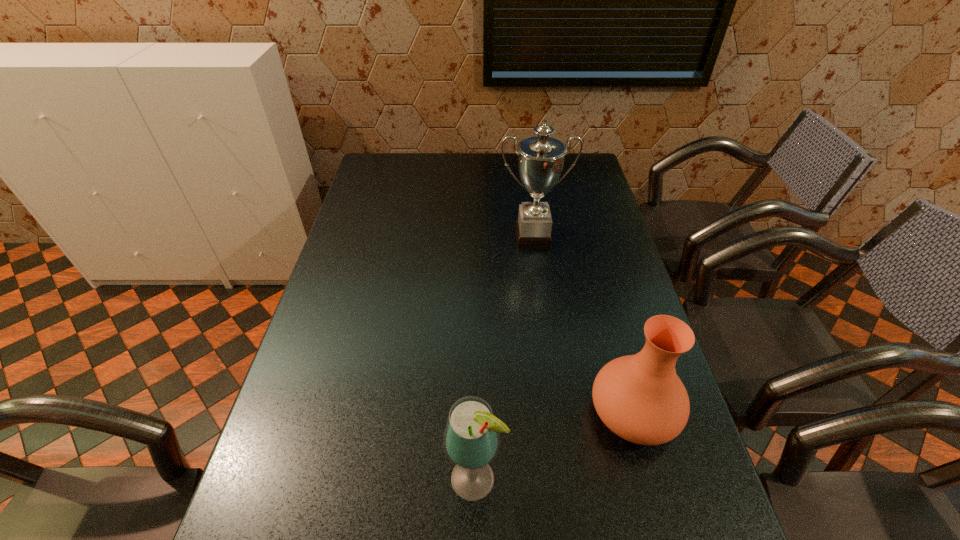
Identify the location of vacant space at the far left corner of the desktop. (398, 158).

This screenshot has width=960, height=540. In the image, there is a desktop. Find the location of `vacant space at the far right corner`. vacant space at the far right corner is located at coordinates (592, 172).

Identify the location of free space between the leftmost object and the farthest object. This screenshot has width=960, height=540. (504, 358).

Find the location of `vacant area that lies between the alcohol and the farthest object`. vacant area that lies between the alcohol and the farthest object is located at coordinates (504, 358).

This screenshot has width=960, height=540. I want to click on empty space between the vase and the farthest object, so click(x=583, y=325).

The height and width of the screenshot is (540, 960). Find the location of `free space between the tallest object and the vase`. free space between the tallest object and the vase is located at coordinates (583, 325).

Locate an element on the screen. The height and width of the screenshot is (540, 960). free spot between the alcohol and the vase is located at coordinates (555, 446).

The image size is (960, 540). I want to click on free space between the farthest object and the leftmost object, so click(x=504, y=358).

Where is `vacant area that lies between the vase and the farthest object`? The height and width of the screenshot is (540, 960). vacant area that lies between the vase and the farthest object is located at coordinates (583, 325).

This screenshot has width=960, height=540. Identify the location of object that stands as the second closest to the alcohol. (541, 158).